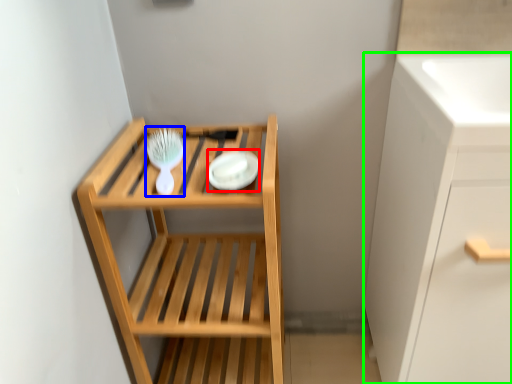
Question: Estimate the real-world distances between objects in this image. Which object is closer to platter (highlighted by a red box), brush (highlighted by a blue box) or cabinetry (highlighted by a green box)?

Choices:
 (A) brush
 (B) cabinetry

Answer: (A)